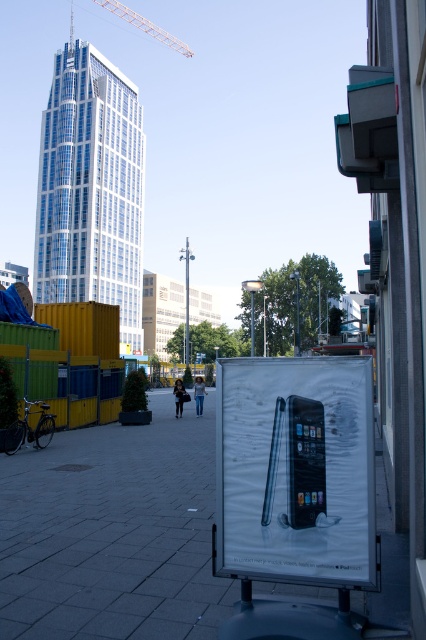
You are standing at the poster on the metal stand in the urban street scene. You notice two points marked in the image. If you were to look towards the direction of the point at coordinates point [66,595] and point [317,564], which point would appear closer to you based on their positions?

Point [317,564] is closer to you because point [66,595] is behind it.

You are a delivery person who needs to place a metallic silver phone at center on the smooth concrete pavement at center. Can the phone fit entirely on the pavement without hanging over the edges?

The smooth concrete pavement at center is wider than the metallic silver phone at center, so yes, the phone can fit entirely on the pavement without hanging over the edges.